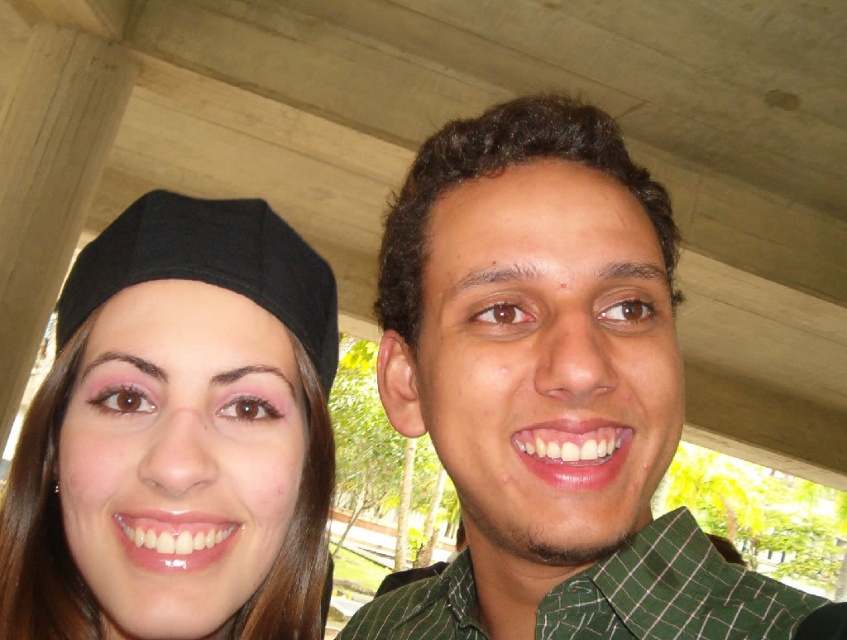
You are a photographer who needs to adjust the lighting for a photo shoot. You notice the matte black cap at left is casting a shadow on the subject. Where should you position the light source to eliminate the shadow?

To eliminate the shadow cast by the matte black cap at left, position the light source directly behind the matte black cap at left, facing towards the subject. This will ensure the light illuminates the subject without the cap blocking it.

You are a photographer trying to capture a group photo of the two people in the scene. You notice that the green checkered shirt at center and the green checkered shirt at right are overlapping. Which shirt should you ask the person to adjust so that the overlapping area is minimized?

The green checkered shirt at center has a smaller width than the green checkered shirt at right. To minimize the overlapping area, the person wearing the green checkered shirt at right should adjust their position since their shirt is wider and might be causing more overlap.

You are a photographer trying to capture a photo of both the green checkered shirt at center and the matte black cap at left in the same frame. Given that your camera has a fixed focal length and limited field of view, which object should you position closer to the camera to ensure both fit within the frame?

Since the green checkered shirt at center is wider than the matte black cap at left, you should position the green checkered shirt at center closer to the camera to ensure both fit within the frame.